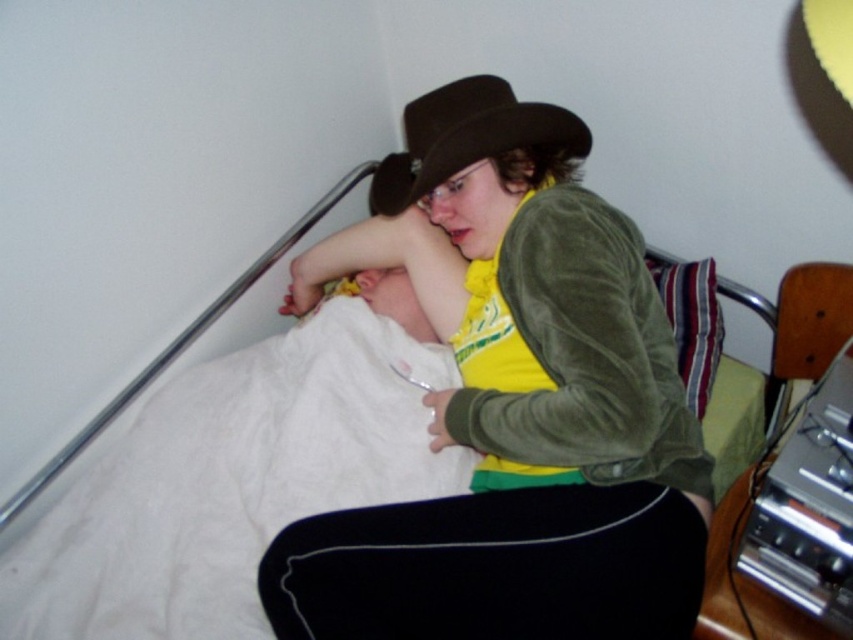
You are designing a new room layout and want to place a decorative item between the black fabric at lower center and the striped fabric pillow at upper right. Considering their sizes, which object should you place the item closer to?

Since the black fabric at lower center is wider than the striped fabric pillow at upper right, you should place the decorative item closer to the striped fabric pillow at upper right to balance the layout.

What is located at the coordinates point (492,566) in the image?

The black fabric at lower center is located at point (492,566).

You are a delivery person who needs to place a small package on the bed. The package must be placed on a surface that is not covered by any fabric. Can you place the package on the black fabric at lower center or the striped fabric pillow at upper right?

The black fabric at lower center is positioned under the striped fabric pillow at upper right, so the striped fabric pillow at upper right covers part of the black fabric at lower center. Therefore, the only available surface without fabric coverage would be the area of the black fabric at lower center not covered by the striped fabric pillow at upper right. However, since the striped fabric pillow at upper right is on top, placing the package there would still be on fabric. Thus, there is no fabricless